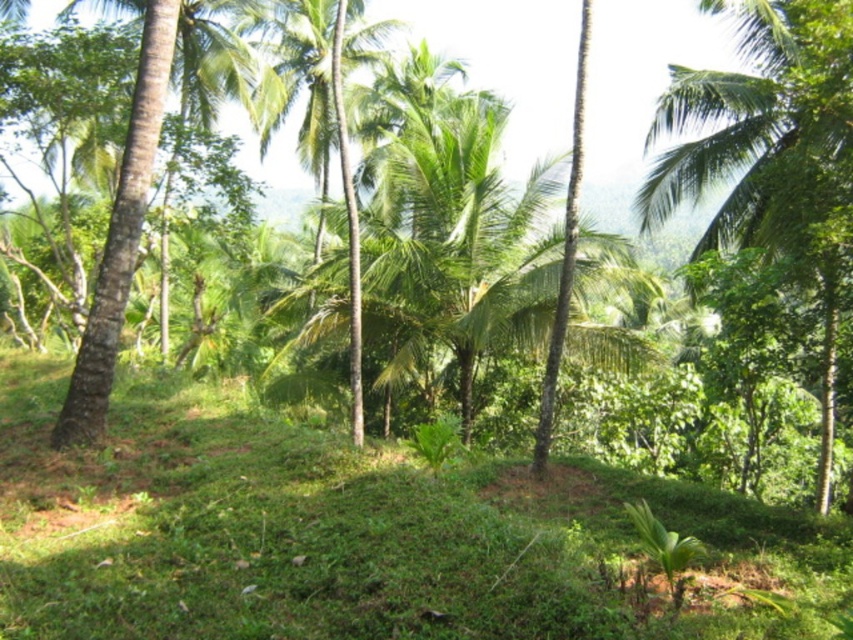
Question: Which of the following is the closest to the observer?

Choices:
 (A) green leafy palm tree at center
 (B) green leafy palm tree at upper right

Answer: (B)

Question: Is green leafy palm tree at upper right wider than green leafy palm tree at center?

Choices:
 (A) no
 (B) yes

Answer: (A)

Question: Which object appears closest to the camera in this image?

Choices:
 (A) green leafy palm tree at upper right
 (B) green leafy palm tree at center

Answer: (A)

Question: Is green leafy palm tree at upper right to the left of green leafy palm tree at center from the viewer's perspective?

Choices:
 (A) yes
 (B) no

Answer: (B)

Question: Can you confirm if green leafy palm tree at upper right is positioned to the left of green leafy palm tree at center?

Choices:
 (A) yes
 (B) no

Answer: (B)

Question: Which point is farther to the camera?

Choices:
 (A) green leafy palm tree at upper right
 (B) green leafy palm tree at center

Answer: (B)